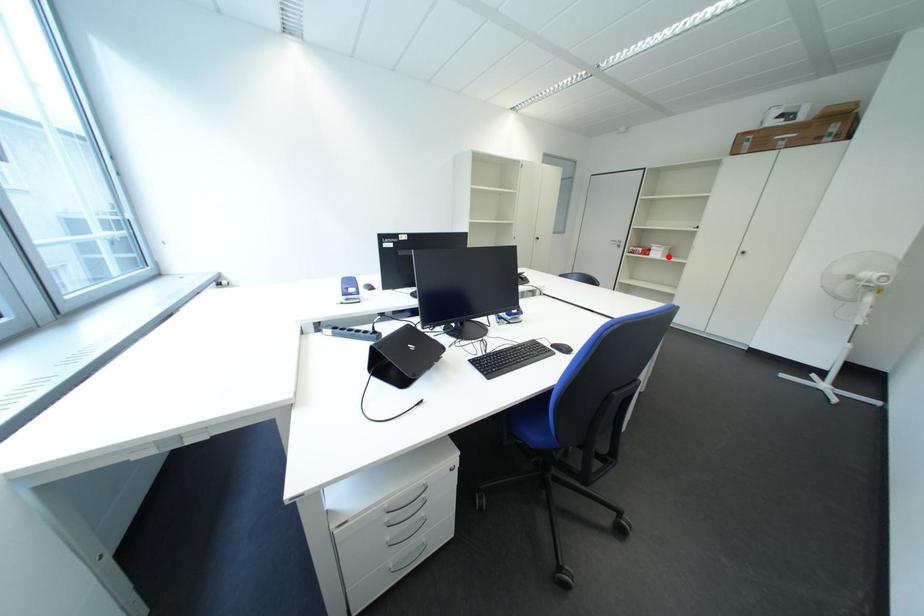
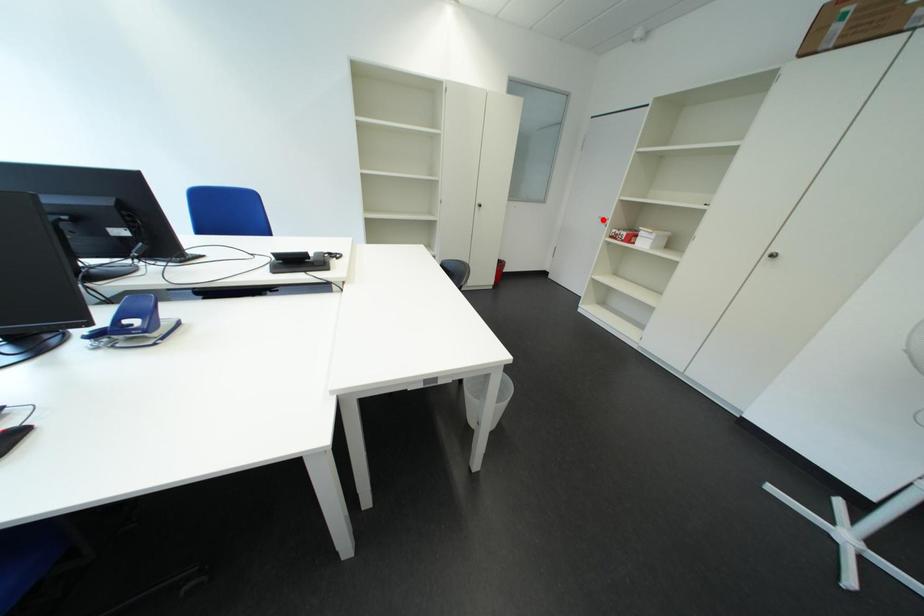
I am providing you with two images of the same scene from different viewpoints. A red point is marked on the first image and another point is marked on the second image. Does the point marked in image1 correspond to the same location as the one in image2?

No